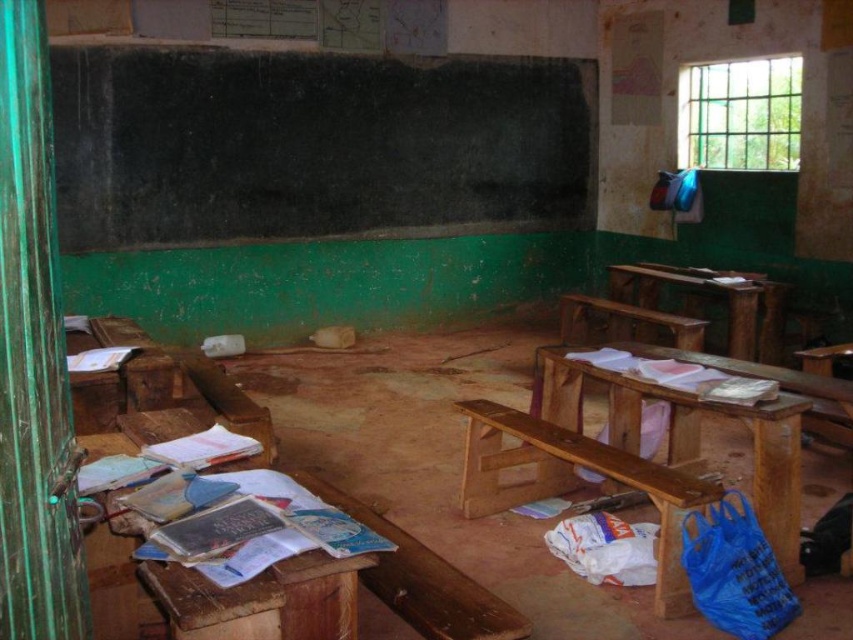
In the scene shown: Between wooden at left and wooden bench at right, which one appears on the left side from the viewer's perspective?

From the viewer's perspective, wooden at left appears more on the left side.

Which is above, wooden at left or wooden bench at right?

wooden bench at right is higher up.

Which is in front, point (123, 538) or point (577, 429)?

Positioned in front is point (123, 538).

The width and height of the screenshot is (853, 640). Find the location of `wooden at left`. wooden at left is located at coordinates click(x=219, y=596).

Who is shorter, wooden at left or brown wooden table at center?

wooden at left

Is wooden at left positioned behind brown wooden table at center?

No, it is not.

Find the location of a particular element. The height and width of the screenshot is (640, 853). wooden at left is located at coordinates (219, 596).

Describe the element at coordinates (312, 145) in the screenshot. I see `black chalkboard at upper center` at that location.

Is point (274, 221) positioned behind point (672, 557)?

Yes, point (274, 221) is behind point (672, 557).

Find the location of a particular element. This screenshot has width=853, height=640. black chalkboard at upper center is located at coordinates (312, 145).